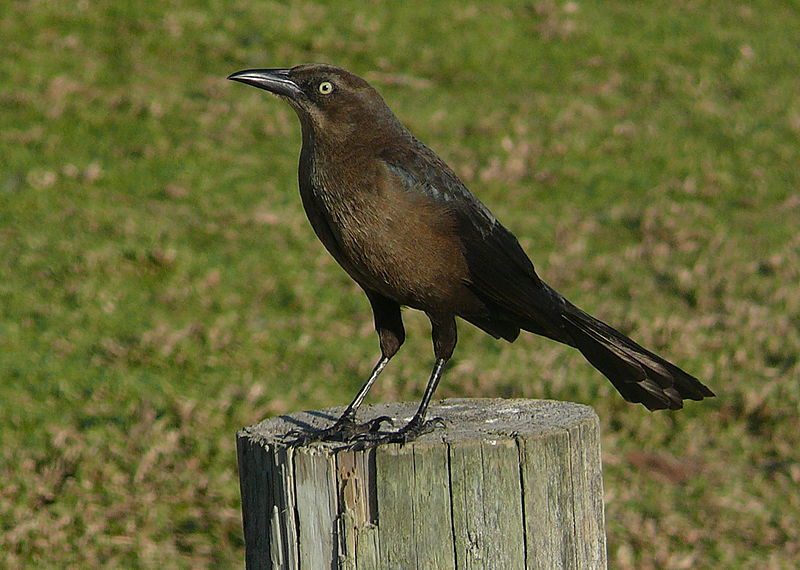
This screenshot has height=570, width=800. I want to click on wood post, so pyautogui.click(x=478, y=507).